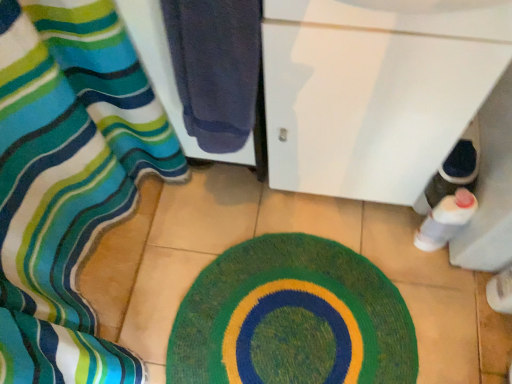
Where is `free space above green knitted bath mat at center (from a real-world perspective)`? This screenshot has height=384, width=512. free space above green knitted bath mat at center (from a real-world perspective) is located at coordinates (294, 319).